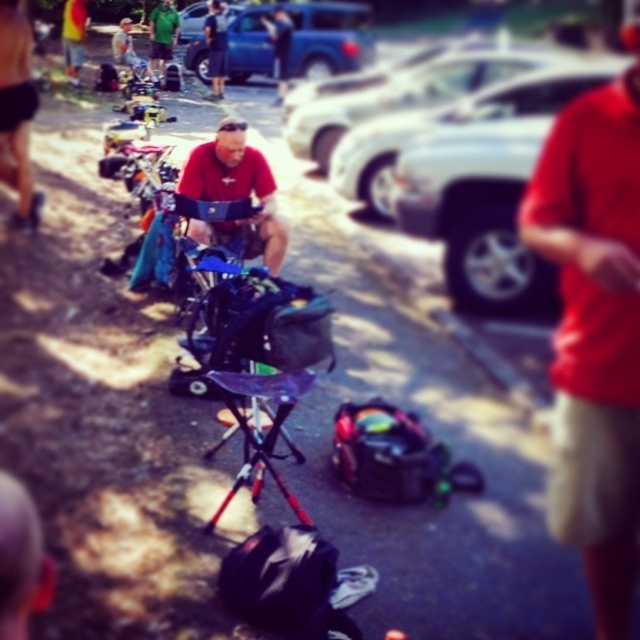
You are standing at the point marked as point (486, 188) in the image. What object is located to your right?

The metallic silver car at right is located to your right at point (486, 188).

From the picture: You are standing in the parking lot and see the point at coordinates (x=234, y=193). What object is located at that point?

The point at coordinates (x=234, y=193) corresponds to the matte red shirt at center.